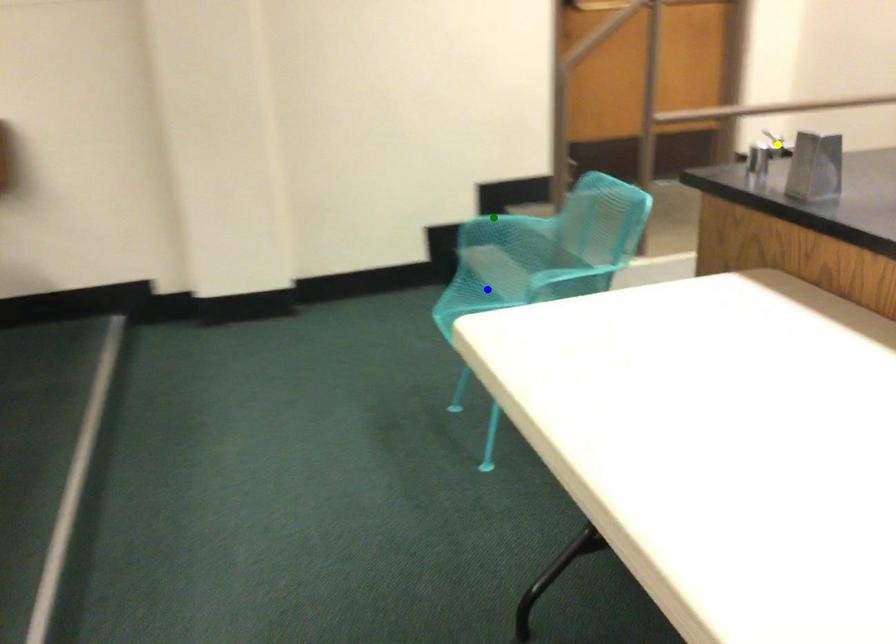
Order these from farthest to nearest:
blue point | yellow point | green point

green point
yellow point
blue point